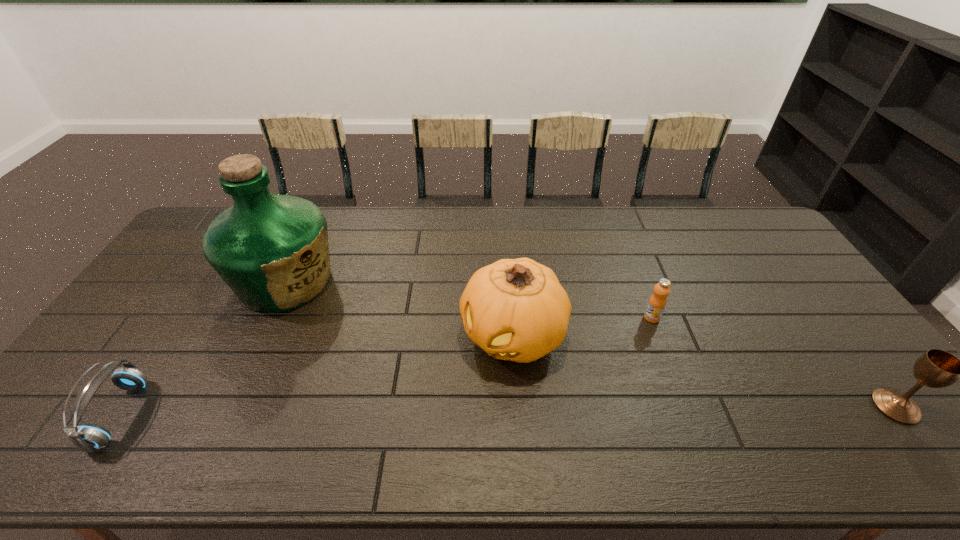
This screenshot has width=960, height=540. What are the coordinates of `free point between the chalice and the second object from right to left` in the screenshot? It's located at (774, 362).

In order to click on vacant region between the tallest object and the third shortest object in this screenshot , I will do `click(590, 344)`.

Identify the location of free space between the third object from left to right and the headset. The image size is (960, 540). (317, 375).

You are a GUI agent. You are given a task and a screenshot of the screen. Output one action in this format:
    pyautogui.click(x=<x>, y=<y>)
    Task: Click on the free space between the second tallest object and the tallest object
    This screenshot has height=540, width=960.
    Given the screenshot: What is the action you would take?
    pyautogui.click(x=399, y=308)

At what (x,y) coordinates should I click in order to perform the action: click on free spot between the orange juice and the headset. Please return your answer as a coordinate pair (x, y). Looking at the image, I should click on (386, 366).

Choose which object is the third nearest neighbor to the second object from right to left. Please provide its 2D coordinates. Your answer should be formatted as a tuple, i.e. [(x, y)], where the tuple contains the x and y coordinates of a point satisfying the conditions above.

[(272, 251)]

Identify which object is the second closest to the orange juice. Please provide its 2D coordinates. Your answer should be formatted as a tuple, i.e. [(x, y)], where the tuple contains the x and y coordinates of a point satisfying the conditions above.

[(936, 368)]

At what (x,y) coordinates should I click in order to perform the action: click on free space that satisfies the following two spatial constraints: 1. on the front side of the rightmost object; 2. on the left side of the second object from left to right. Please return your answer as a coordinate pair (x, y). The width and height of the screenshot is (960, 540). Looking at the image, I should click on (228, 406).

Where is `vacant region that satisfies the following two spatial constraints: 1. on the front side of the tallest object; 2. on the right side of the fourth object from left to right`? This screenshot has height=540, width=960. vacant region that satisfies the following two spatial constraints: 1. on the front side of the tallest object; 2. on the right side of the fourth object from left to right is located at coordinates (269, 318).

I want to click on vacant area that satisfies the following two spatial constraints: 1. on the front side of the fourth shortest object; 2. on the right side of the third tallest object, so click(517, 406).